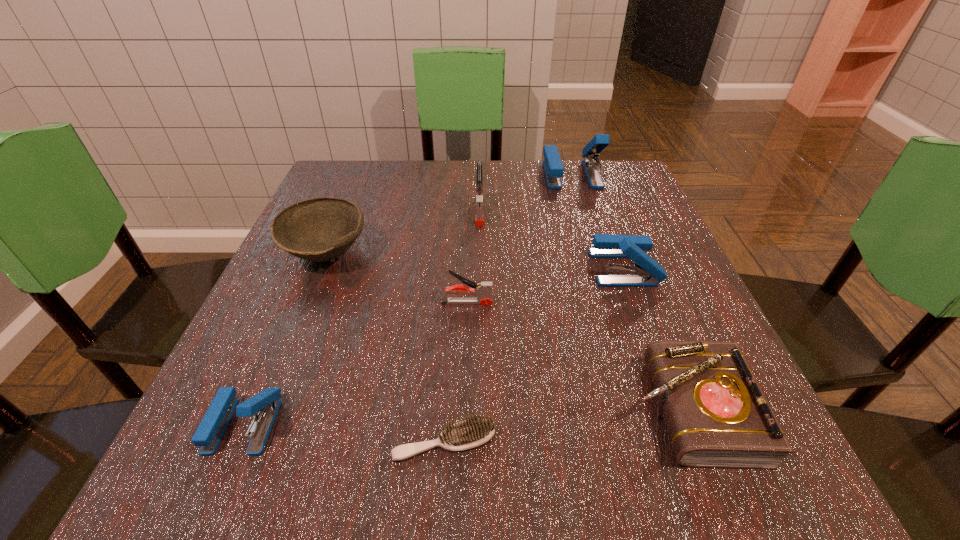
Identify the location of the farthest stapler. Image resolution: width=960 pixels, height=540 pixels. (553, 167).

Find the location of a particular element. the biggest blue stapler is located at coordinates (553, 167).

The image size is (960, 540). Identify the location of the farther gray stapler. (479, 217).

Locate an element on the screen. the bigger gray stapler is located at coordinates (479, 217).

In order to click on the second nearest blue stapler in this screenshot , I will do `click(646, 272)`.

The height and width of the screenshot is (540, 960). Find the location of `the second smallest blue stapler`. the second smallest blue stapler is located at coordinates (646, 272).

Find the location of a particular element. The width and height of the screenshot is (960, 540). bowl is located at coordinates (319, 229).

The width and height of the screenshot is (960, 540). What are the coordinates of `the second nearest stapler` in the screenshot? It's located at 483,290.

This screenshot has width=960, height=540. In order to click on the nearer gray stapler in this screenshot , I will do `click(483, 290)`.

The width and height of the screenshot is (960, 540). I want to click on the smallest blue stapler, so click(265, 404).